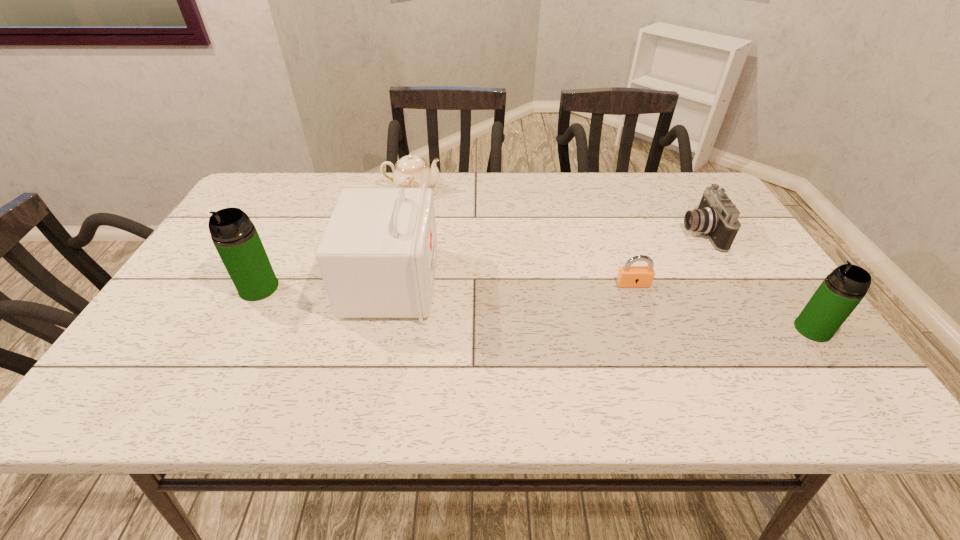
Find the location of a particular element. Image resolution: width=960 pixels, height=540 pixels. camera that is at the far edge is located at coordinates (716, 216).

Where is `object that is at the near edge`? This screenshot has width=960, height=540. object that is at the near edge is located at coordinates (842, 290).

Locate an element on the screen. This screenshot has height=540, width=960. object that is at the left edge is located at coordinates (234, 236).

I want to click on thermos bottle present at the right edge, so click(842, 290).

I want to click on camera that is at the right edge, so click(x=716, y=216).

This screenshot has height=540, width=960. In order to click on object positioned at the far right corner in this screenshot , I will do `click(716, 216)`.

Locate an element on the screen. This screenshot has width=960, height=540. object that is at the near right corner is located at coordinates (842, 290).

Identify the location of free region at the far edge. This screenshot has height=540, width=960. (314, 213).

This screenshot has width=960, height=540. What are the coordinates of `vacant space at the near edge of the desktop` in the screenshot? It's located at (668, 346).

I want to click on free location at the left edge of the desktop, so click(x=222, y=265).